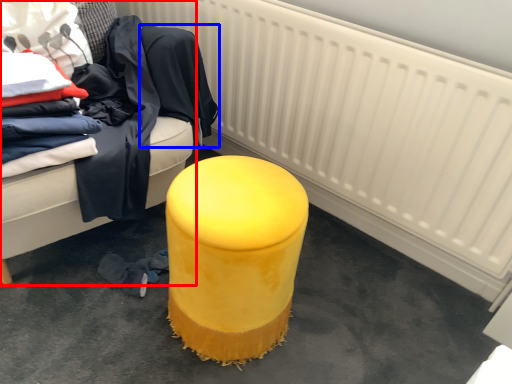
Question: Which point is further to the camera, furniture (highlighted by a red box) or clothing (highlighted by a blue box)?

Choices:
 (A) furniture
 (B) clothing

Answer: (B)